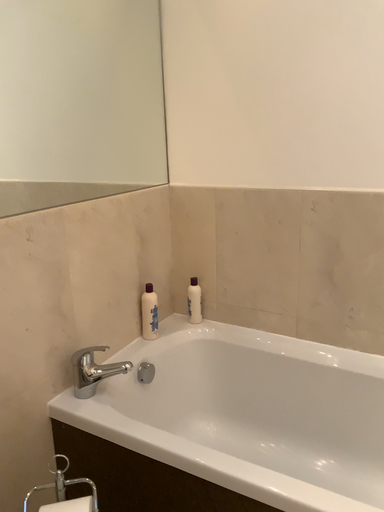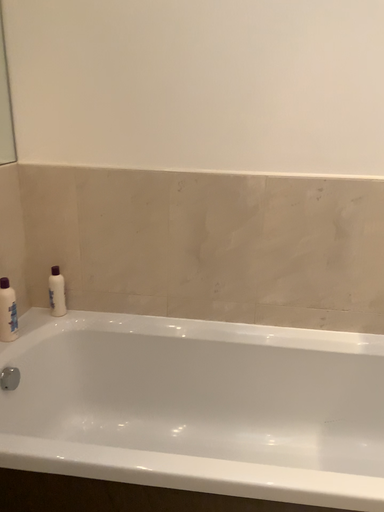
Question: How did the camera likely rotate when shooting the video?

Choices:
 (A) rotated left
 (B) rotated right

Answer: (B)